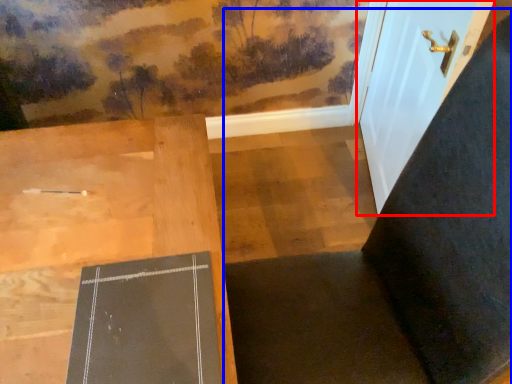
Question: Which object is closer to the camera taking this photo, door (highlighted by a red box) or chair (highlighted by a blue box)?

Choices:
 (A) door
 (B) chair

Answer: (B)